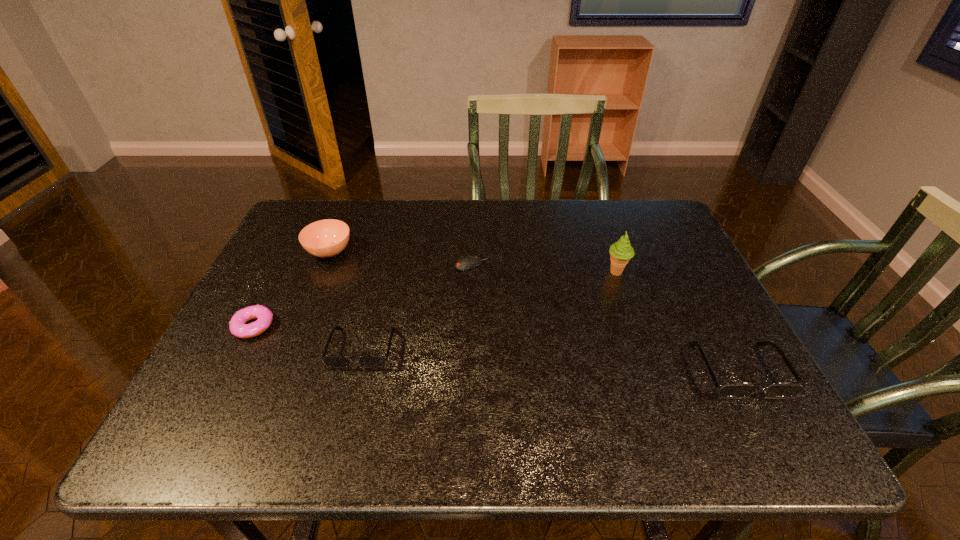
Find the location of a particular element. vacant region between the third shortest object and the third tallest object is located at coordinates (550, 360).

Image resolution: width=960 pixels, height=540 pixels. What are the coordinates of `free space between the fourth shortest object and the doughnut` in the screenshot? It's located at (496, 348).

This screenshot has width=960, height=540. Identify the location of free point between the computer mouse and the taller sunglasses. (605, 318).

Image resolution: width=960 pixels, height=540 pixels. I want to click on blank region between the doughnut and the computer mouse, so click(x=363, y=295).

Identify the location of free spot between the soup bowl and the taller sunglasses. (534, 311).

Choose which object is the nearest neighbor to the second shortest object. Please provide its 2D coordinates. Your answer should be formatted as a tuple, i.e. [(x, y)], where the tuple contains the x and y coordinates of a point satisfying the conditions above.

[(330, 361)]

Locate an element on the screen. object that is the second closest to the computer mouse is located at coordinates click(x=326, y=238).

Where is `free space that satisfies the following two spatial constraints: 1. on the back side of the doughnut; 2. on the right side of the tallest object`? This screenshot has width=960, height=540. free space that satisfies the following two spatial constraints: 1. on the back side of the doughnut; 2. on the right side of the tallest object is located at coordinates (281, 272).

This screenshot has width=960, height=540. In order to click on vacant point that satisfies the following two spatial constraints: 1. on the back side of the computer mouse; 2. on the right side of the second shortest object in this screenshot , I will do `click(285, 265)`.